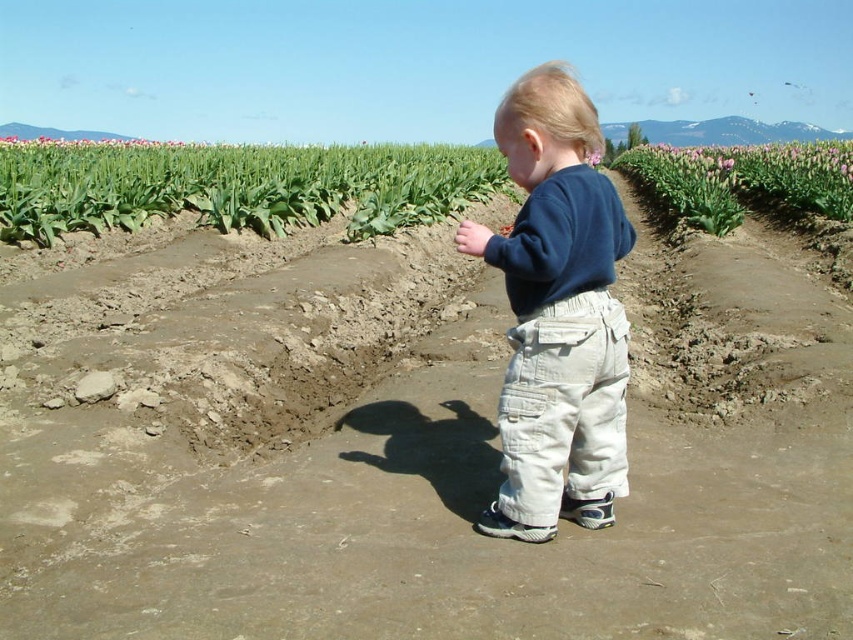
Does dark blue cotton shirt at center have a larger size compared to green leafy corn field at upper left?

No.

Can you confirm if dark blue cotton shirt at center is wider than green leafy corn field at upper left?

No.

Find the location of `dark blue cotton shirt at center`. dark blue cotton shirt at center is located at coordinates (556, 314).

Between green leafy corn field at upper left and pink tulip field at right, which one has more height?

pink tulip field at right

Can you confirm if green leafy corn field at upper left is positioned to the right of pink tulip field at right?

In fact, green leafy corn field at upper left is to the left of pink tulip field at right.

Who is more forward, (407, 160) or (786, 211)?

Point (786, 211) is more forward.

Locate an element on the screen. This screenshot has height=640, width=853. green leafy corn field at upper left is located at coordinates (234, 186).

In the scene shown: Can you confirm if brown muddy path at center is positioned above green leafy corn field at upper left?

Actually, brown muddy path at center is below green leafy corn field at upper left.

I want to click on brown muddy path at center, so click(x=497, y=483).